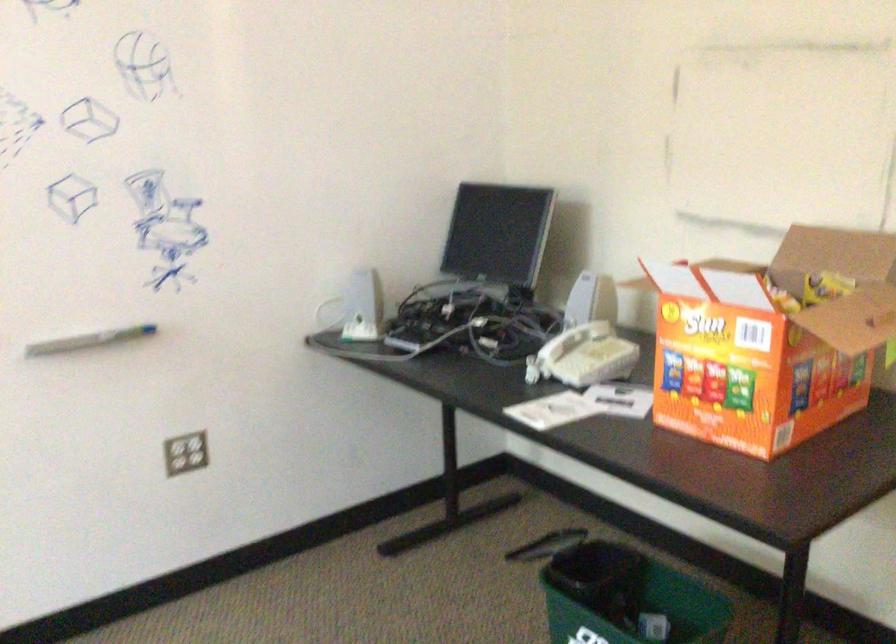
Where would you lift the telephone handset? Please return your answer as a coordinate pair (x, y).

(558, 345)